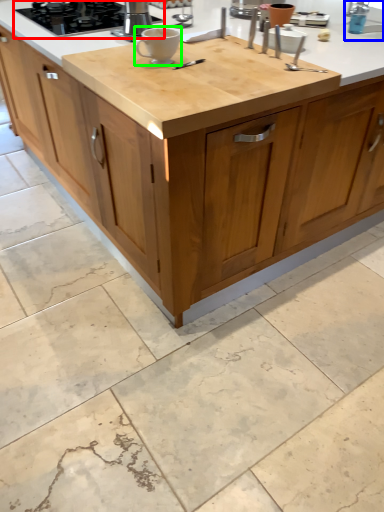
Question: Which is nearer to the gas stove (highlighted by a red box)? faucet (highlighted by a blue box) or coffee cup (highlighted by a green box).

Choices:
 (A) faucet
 (B) coffee cup

Answer: (B)